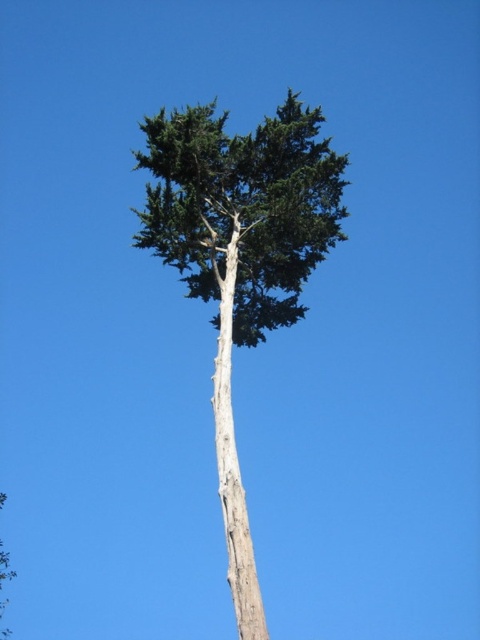
Question: Does green rough bark tree at center have a larger size compared to light brown bark tree trunk at center?

Choices:
 (A) yes
 (B) no

Answer: (A)

Question: Is green rough bark tree at center bigger than light brown bark tree trunk at center?

Choices:
 (A) yes
 (B) no

Answer: (A)

Question: Can you confirm if green rough bark tree at center is positioned below light brown bark tree trunk at center?

Choices:
 (A) yes
 (B) no

Answer: (B)

Question: Which object appears farthest from the camera in this image?

Choices:
 (A) green rough bark tree at center
 (B) light brown bark tree trunk at center

Answer: (B)